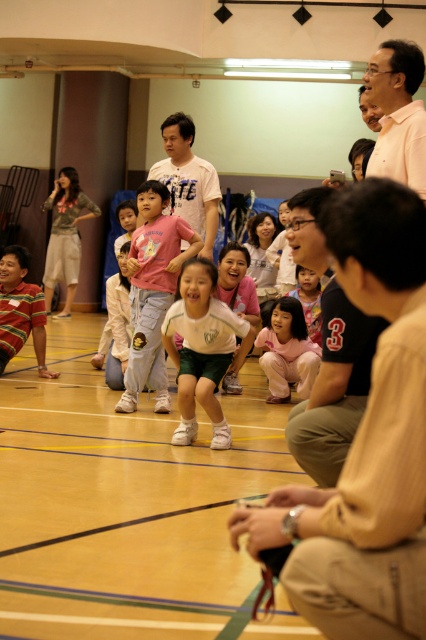
Based on the photo, you are a photographer at the gymnasium and want to take a photo of both the black shirt at center and the matte pink shirt at center. Which one should you focus on first if you want to capture them from left to right?

You should focus on the black shirt at center first since it is positioned on the left side of the matte pink shirt at center, so capturing them from left to right would start with the black shirt at center.

You are organizing a photoshoot and need to place a mannequin wearing the striped cotton shirt at lower left next to the pink fabric pants at center. Based on their sizes, which clothing item should be placed closer to the camera to avoid overcrowding?

The striped cotton shirt at lower left should be placed closer to the camera since it is narrower than the pink fabric pants at center, which are wider. This arrangement will prevent overcrowding between the two items.